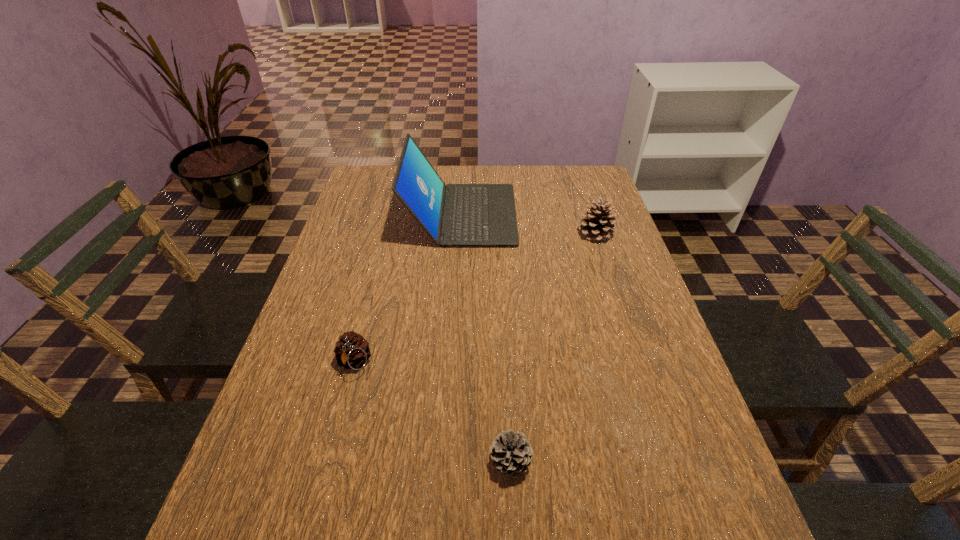
Find the location of a particular element. This screenshot has width=960, height=540. pinecone that stands as the closest to the third farthest object is located at coordinates (511, 453).

Select which pinecone appears as the closest to the rightmost object. Please provide its 2D coordinates. Your answer should be formatted as a tuple, i.e. [(x, y)], where the tuple contains the x and y coordinates of a point satisfying the conditions above.

[(511, 453)]

I want to click on vacant space that satisfies the following two spatial constraints: 1. on the screen of the laptop computer; 2. with a leaf charm attached to the second farthest pinecone, so click(x=453, y=362).

Locate an element on the screen. The width and height of the screenshot is (960, 540). vacant area in the image that satisfies the following two spatial constraints: 1. on the screen of the tallest object; 2. on the left side of the second pinecone from left to right is located at coordinates (447, 462).

Identify the location of free space that satisfies the following two spatial constraints: 1. on the screen of the laptop computer; 2. with a leaf charm attached to the leftmost object. (453, 362).

This screenshot has height=540, width=960. What are the coordinates of `free location that satisfies the following two spatial constraints: 1. on the screen of the tallest object; 2. with a leaf charm attached to the third farthest object` in the screenshot? It's located at (453, 362).

This screenshot has height=540, width=960. In order to click on free location that satisfies the following two spatial constraints: 1. with a leaf charm attached to the nearest pinecone; 2. on the left side of the third farthest object in this screenshot , I will do `click(327, 462)`.

Locate an element on the screen. vacant region that satisfies the following two spatial constraints: 1. on the back side of the second tallest object; 2. on the right side of the nearest object is located at coordinates (498, 234).